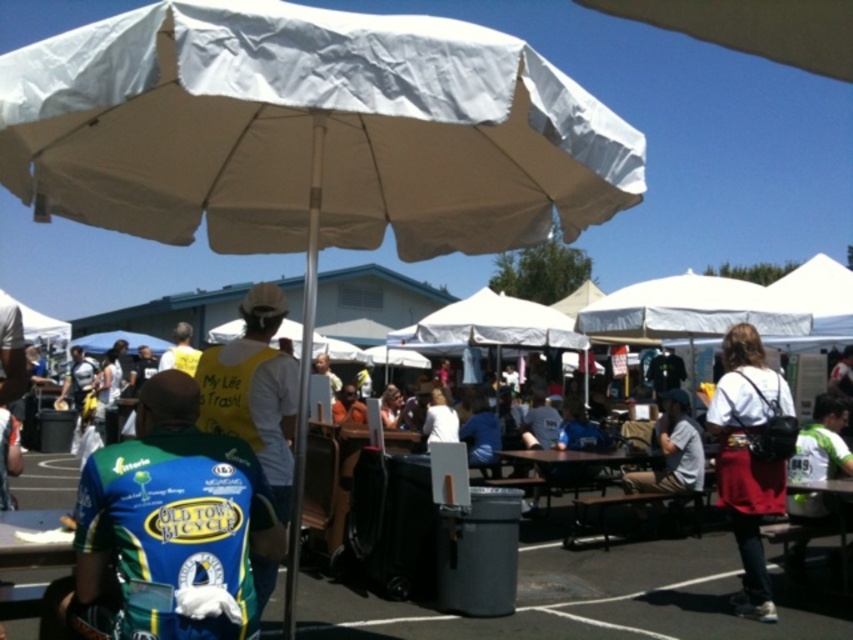
You are a photographer at the event and need to capture both the white matte shirt at center and the white cotton shirt at center in a single frame. Since you want both shirts to appear clearly, which shirt should you focus on to ensure the smaller one is in sharp focus?

The white matte shirt at center is smaller than the white cotton shirt at center. To ensure the smaller one is in sharp focus, you should focus on the white matte shirt at center.

Based on the scene description and the position of the white matte shirt at center, can you determine if the person wearing it is under the shade of the large beige umbrella?

The white matte shirt at center is located at coordinates (x=750, y=456). Since the beige umbrella is in the foreground and the shirt is at center, it is likely under the shade of the large beige umbrella.

You are at the event and want to take a photo of both the blue jersey at center and the white cotton shirt at center. Which one should you focus on first if you want to capture them both in the same frame without moving your camera?

You should focus on the blue jersey at center first since it is to the left of the white cotton shirt at center, allowing both to be in the frame when positioned correctly.